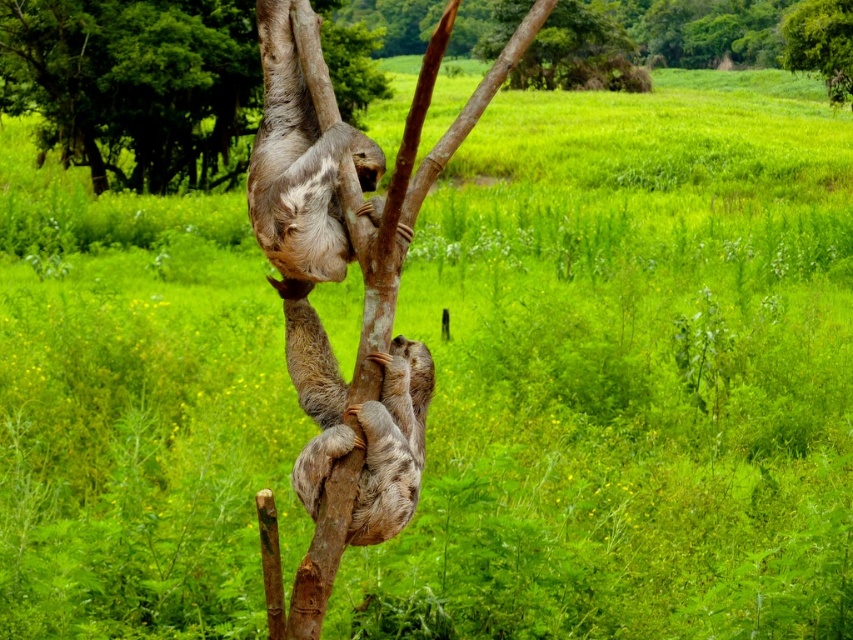
Can you confirm if brown rough tree trunk at upper center is positioned below brown fuzzy sloth at center?

No, brown rough tree trunk at upper center is not below brown fuzzy sloth at center.

In the scene shown: Which of these two, brown rough tree trunk at upper center or brown fuzzy sloth at center, stands shorter?

brown rough tree trunk at upper center is shorter.

Does point (229, 147) come in front of point (373, 428)?

No, (229, 147) is behind (373, 428).

Locate an element on the screen. Image resolution: width=853 pixels, height=640 pixels. brown rough tree trunk at upper center is located at coordinates (135, 84).

Is brown rough tree trunk at upper center positioned behind green leafy tree at upper right?

No, brown rough tree trunk at upper center is in front of green leafy tree at upper right.

Does brown rough tree trunk at upper center have a larger size compared to green leafy tree at upper right?

Yes, brown rough tree trunk at upper center is bigger than green leafy tree at upper right.

Is point (96, 88) farther from camera compared to point (839, 81)?

No, it is not.

Locate an element on the screen. brown rough tree trunk at upper center is located at coordinates (135, 84).

Who is positioned more to the right, brown fuzzy sloth at center or green leafy tree at upper right?

Positioned to the right is green leafy tree at upper right.

Which of these two, brown fuzzy sloth at center or green leafy tree at upper right, stands shorter?

green leafy tree at upper right is shorter.

What do you see at coordinates (366, 435) in the screenshot? I see `brown fuzzy sloth at center` at bounding box center [366, 435].

Where is `brown fuzzy sloth at center`? The width and height of the screenshot is (853, 640). brown fuzzy sloth at center is located at coordinates (366, 435).